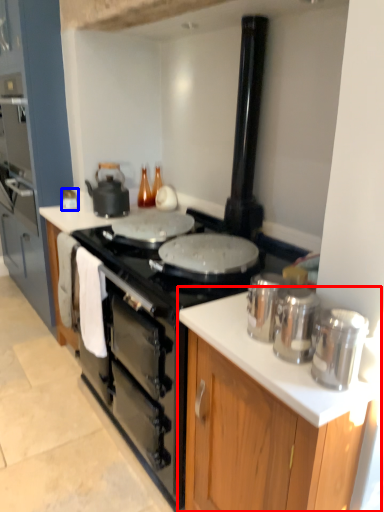
Question: Which object is further to the camera taking this photo, cabinetry (highlighted by a red box) or kitchen appliance (highlighted by a blue box)?

Choices:
 (A) cabinetry
 (B) kitchen appliance

Answer: (B)